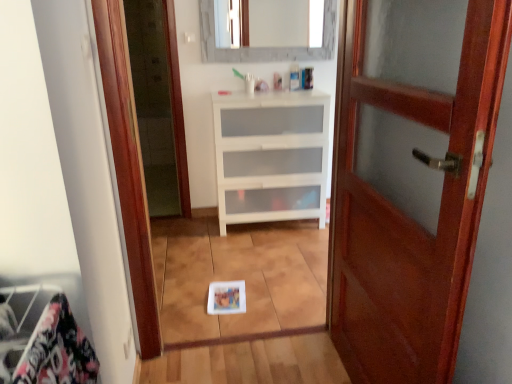
Question: From the image's perspective, would you say white matte chest of drawers at center is shown under matte gray mirror at upper center?

Choices:
 (A) no
 (B) yes

Answer: (B)

Question: Does white matte chest of drawers at center have a greater height compared to matte gray mirror at upper center?

Choices:
 (A) no
 (B) yes

Answer: (B)

Question: Is white matte chest of drawers at center surrounding matte gray mirror at upper center?

Choices:
 (A) no
 (B) yes

Answer: (A)

Question: Is white matte chest of drawers at center facing away from matte gray mirror at upper center?

Choices:
 (A) yes
 (B) no

Answer: (B)

Question: Is the position of white matte chest of drawers at center less distant than that of matte gray mirror at upper center?

Choices:
 (A) no
 (B) yes

Answer: (B)

Question: Is mahogany wood door at right to the left or to the right of white matte chest of drawers at center in the image?

Choices:
 (A) right
 (B) left

Answer: (A)

Question: Relative to white matte chest of drawers at center, is mahogany wood door at right in front or behind?

Choices:
 (A) behind
 (B) front

Answer: (B)

Question: Considering the positions of mahogany wood door at right and white matte chest of drawers at center in the image, is mahogany wood door at right bigger or smaller than white matte chest of drawers at center?

Choices:
 (A) big
 (B) small

Answer: (B)

Question: Is point (480, 102) closer or farther from the camera than point (236, 200)?

Choices:
 (A) closer
 (B) farther

Answer: (A)

Question: Would you say white matte chest of drawers at center is to the left or to the right of mahogany wood door at right in the picture?

Choices:
 (A) left
 (B) right

Answer: (A)

Question: From a real-world perspective, is white matte chest of drawers at center positioned above or below mahogany wood door at right?

Choices:
 (A) above
 (B) below

Answer: (B)

Question: In terms of width, does white matte chest of drawers at center look wider or thinner when compared to mahogany wood door at right?

Choices:
 (A) thin
 (B) wide

Answer: (B)

Question: Is white matte chest of drawers at center in front of or behind mahogany wood door at right in the image?

Choices:
 (A) front
 (B) behind

Answer: (B)

Question: Is point (316, 162) closer or farther from the camera than point (305, 29)?

Choices:
 (A) closer
 (B) farther

Answer: (A)

Question: From a real-world perspective, relative to matte gray mirror at upper center, is white matte chest of drawers at center vertically above or below?

Choices:
 (A) below
 (B) above

Answer: (A)